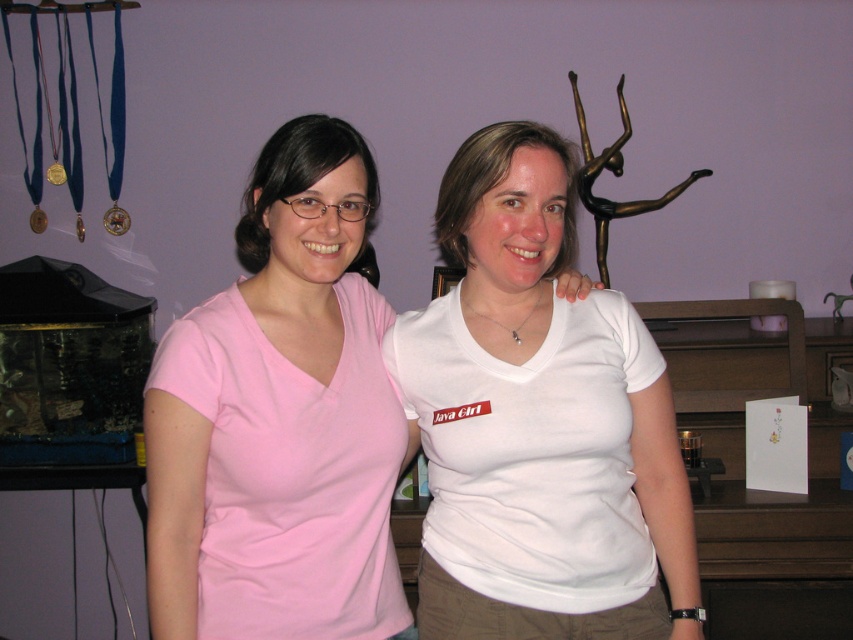
Question: Can you confirm if white matte shirt at center is thinner than pink matte t-shirt at center?

Choices:
 (A) no
 (B) yes

Answer: (A)

Question: Can you confirm if white matte shirt at center is bigger than pink matte t-shirt at center?

Choices:
 (A) no
 (B) yes

Answer: (B)

Question: Which point is farther to the camera?

Choices:
 (A) pink matte t-shirt at center
 (B) white matte shirt at center

Answer: (B)

Question: Which point appears closest to the camera in this image?

Choices:
 (A) (479, 316)
 (B) (207, 500)

Answer: (B)

Question: Observing the image, what is the correct spatial positioning of white matte shirt at center in reference to pink matte t-shirt at center?

Choices:
 (A) left
 (B) right

Answer: (B)